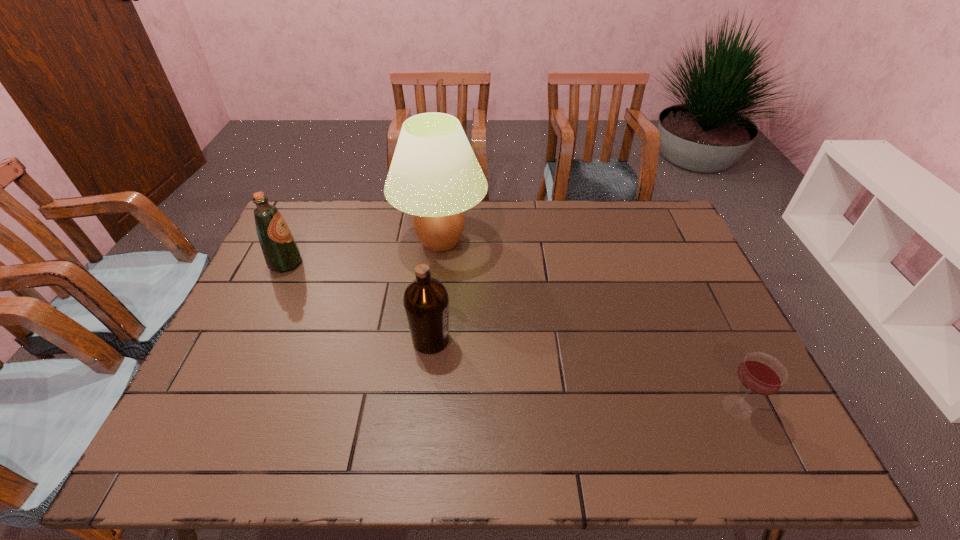
This screenshot has width=960, height=540. I want to click on lampshade, so (434, 175).

In order to click on the nearer olive oil in this screenshot , I will do `click(426, 302)`.

I want to click on the right olive oil, so click(426, 302).

Identify the location of the left olive oil. (281, 253).

At what (x,y) coordinates should I click in order to perform the action: click on the farther olive oil. Please return your answer as a coordinate pair (x, y). The height and width of the screenshot is (540, 960). Looking at the image, I should click on (281, 253).

Find the location of `wineglass`. wineglass is located at coordinates (760, 373).

Image resolution: width=960 pixels, height=540 pixels. Identify the location of the shortest object. (760, 373).

Locate an element on the screen. Image resolution: width=960 pixels, height=540 pixels. vacant space located 0.080m on the shade of the lampshade is located at coordinates (435, 292).

The image size is (960, 540). Find the location of `free space located 0.200m on the label of the nearer olive oil`. free space located 0.200m on the label of the nearer olive oil is located at coordinates (525, 340).

Where is `vacant area situated 0.220m on the front-facing side of the left olive oil`? vacant area situated 0.220m on the front-facing side of the left olive oil is located at coordinates (372, 263).